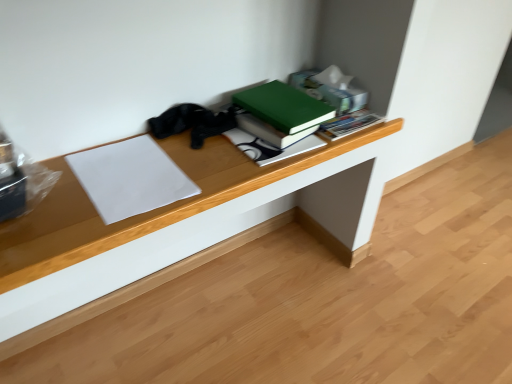
Question: Which direction should I rotate to look at green matte book at upper center, acting as the first paperback book starting from the right, — up or down?

Choices:
 (A) up
 (B) down

Answer: (A)

Question: From a real-world perspective, is wooden desk at center positioned over green matte book at upper center, positioned as the second paperback book in left-to-right order, based on gravity?

Choices:
 (A) no
 (B) yes

Answer: (A)

Question: Would you say wooden desk at center is outside green matte book at upper center, acting as the first paperback book starting from the right?

Choices:
 (A) yes
 (B) no

Answer: (A)

Question: From the image's perspective, would you say wooden desk at center is shown under green matte book at upper center, positioned as the 2th paperback book in bottom-to-top order?

Choices:
 (A) yes
 (B) no

Answer: (A)

Question: Can you confirm if wooden desk at center is taller than green matte book at upper center, which is counted as the 2th paperback book, starting from the front?

Choices:
 (A) no
 (B) yes

Answer: (A)

Question: Does wooden desk at center have a lesser height compared to green matte book at upper center, placed as the first paperback book when sorted from top to bottom?

Choices:
 (A) yes
 (B) no

Answer: (A)

Question: Are wooden desk at center and green matte book at upper center, positioned as the 2th paperback book in bottom-to-top order, located far from each other?

Choices:
 (A) no
 (B) yes

Answer: (A)

Question: Considering the relative sizes of white paper at left, arranged as the first paperback book when viewed from the front, and green matte book at upper center, positioned as the 2th paperback book in bottom-to-top order, in the image provided, is white paper at left, arranged as the first paperback book when viewed from the front, smaller than green matte book at upper center, positioned as the 2th paperback book in bottom-to-top order,?

Choices:
 (A) no
 (B) yes

Answer: (B)

Question: Is white paper at left, arranged as the first paperback book when viewed from the front, shorter than green matte book at upper center, acting as the first paperback book starting from the right?

Choices:
 (A) no
 (B) yes

Answer: (B)

Question: Is white paper at left, the first paperback book positioned from the left, facing away from green matte book at upper center, acting as the first paperback book starting from the right?

Choices:
 (A) no
 (B) yes

Answer: (A)

Question: Is white paper at left, the first paperback book positioned from the left, to the left of green matte book at upper center, which is counted as the 2th paperback book, starting from the front, from the viewer's perspective?

Choices:
 (A) yes
 (B) no

Answer: (A)

Question: Can green matte book at upper center, acting as the first paperback book starting from the right, be found inside white paper at left, placed as the 2th paperback book when sorted from top to bottom?

Choices:
 (A) no
 (B) yes

Answer: (A)

Question: Is white paper at left, which is counted as the 2th paperback book, starting from the back, not inside green matte book at upper center, placed as the first paperback book when sorted from top to bottom?

Choices:
 (A) yes
 (B) no

Answer: (A)

Question: Is wooden desk at center completely or partially inside green matte book at upper center, which is the 1th paperback book from back to front?

Choices:
 (A) yes
 (B) no

Answer: (B)